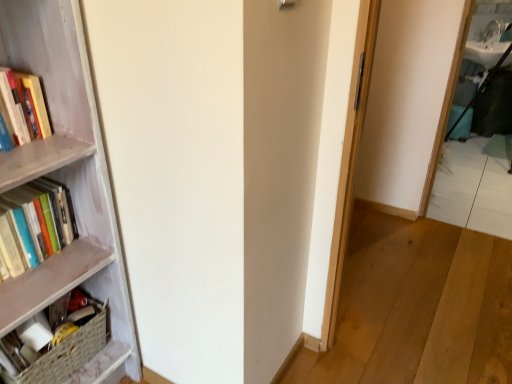
The image size is (512, 384). In order to click on free spot above woven basket at lower left, arranged as the first book when ordered from the bottom (from a real-world perspective) in this screenshot , I will do `click(57, 324)`.